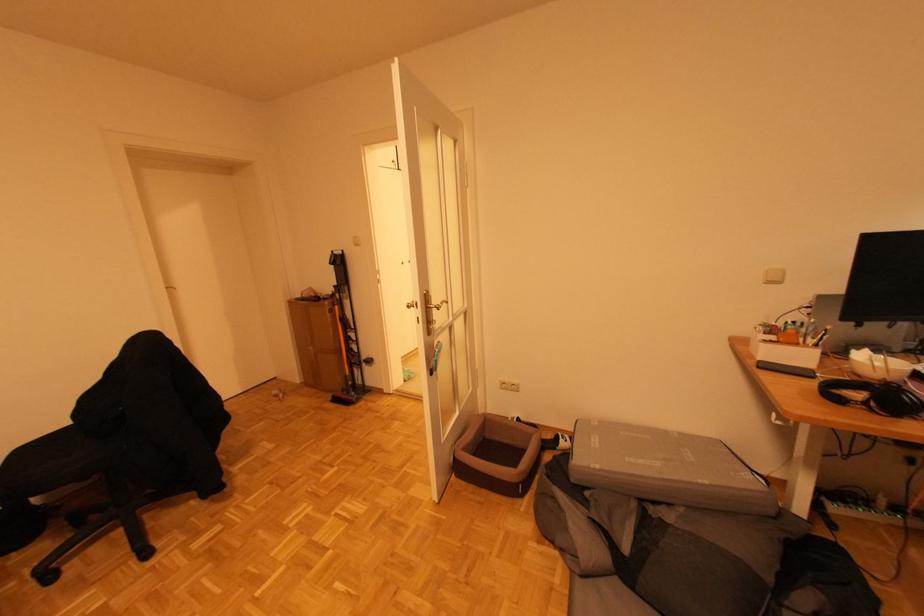
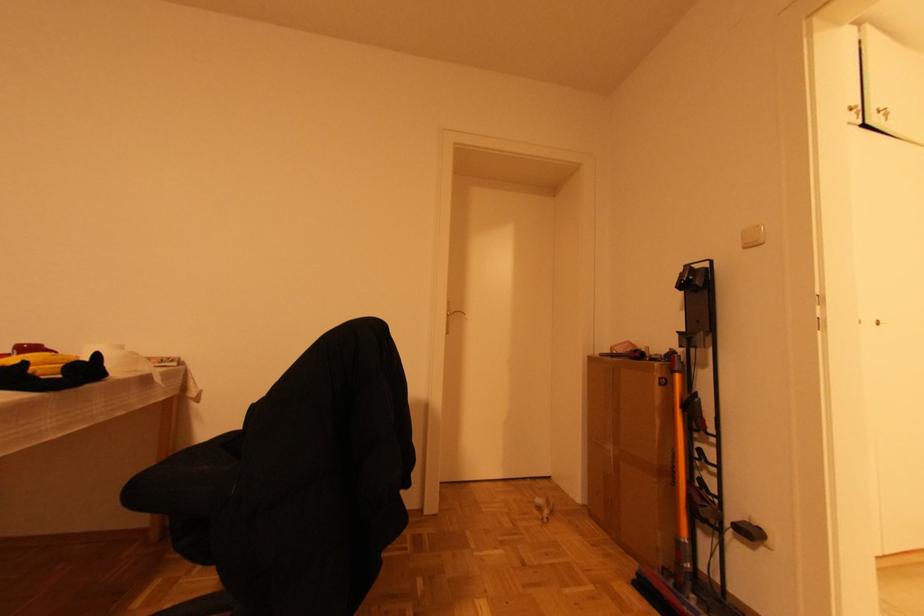
In the second image, find the point that corresponds to point (412, 264) in the first image.

(881, 325)